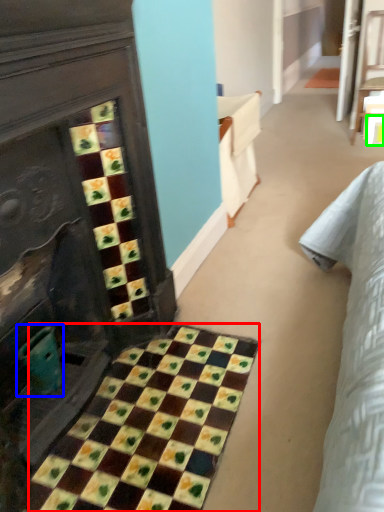
Question: Based on their relative distances, which object is nearer to ceramic tile (highlighted by a red box)? Choose from teal (highlighted by a blue box) and square (highlighted by a green box).

Choices:
 (A) teal
 (B) square

Answer: (A)